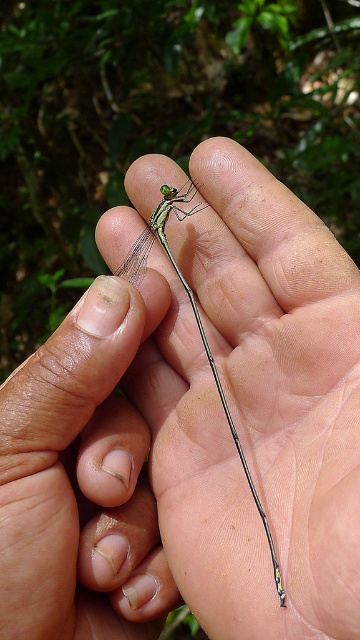
Question: Does transparent glass mantid at center have a larger size compared to transparent green dragonfly at center?

Choices:
 (A) yes
 (B) no

Answer: (B)

Question: Can you confirm if transparent glass mantid at center is positioned to the left of transparent green dragonfly at center?

Choices:
 (A) no
 (B) yes

Answer: (B)

Question: Can you confirm if transparent glass mantid at center is positioned to the right of transparent green dragonfly at center?

Choices:
 (A) no
 (B) yes

Answer: (A)

Question: Which of the following is the closest to the observer?

Choices:
 (A) (227, 406)
 (B) (77, 474)

Answer: (B)

Question: Among these objects, which one is nearest to the camera?

Choices:
 (A) transparent green dragonfly at center
 (B) transparent glass mantid at center

Answer: (B)